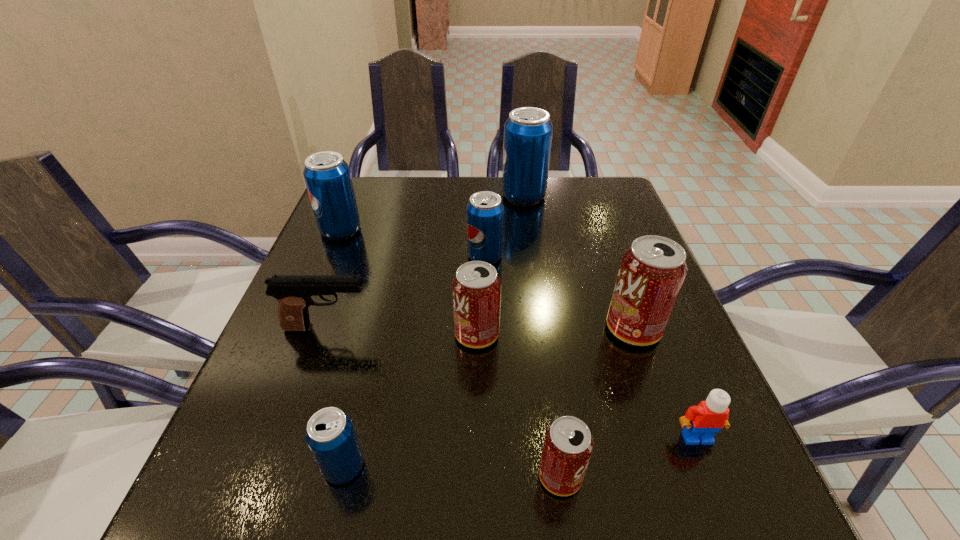
This screenshot has height=540, width=960. In order to click on the biggest blue pop soda in this screenshot , I will do `click(528, 131)`.

This screenshot has height=540, width=960. Identify the location of the tallest object. (528, 131).

Identify the location of the second farthest soda can. (327, 176).

Find the location of a particular element. The width and height of the screenshot is (960, 540). the leftmost soda can is located at coordinates (327, 176).

Locate an element on the screen. The height and width of the screenshot is (540, 960). the rightmost soda can is located at coordinates (652, 271).

I want to click on the rightmost red soda can, so click(x=652, y=271).

I want to click on the second smallest red soda can, so click(x=476, y=288).

You are a GUI agent. You are given a task and a screenshot of the screen. Output one action in this format:
    pyautogui.click(x=<x>, y=<y>)
    Task: Click on the second blue pop soda from right to left
    The image size is (960, 540).
    Given the screenshot: What is the action you would take?
    pyautogui.click(x=485, y=211)

Identify the location of the seventh nearest object. The height and width of the screenshot is (540, 960). (485, 211).

Where is `pistol`? pistol is located at coordinates (293, 292).